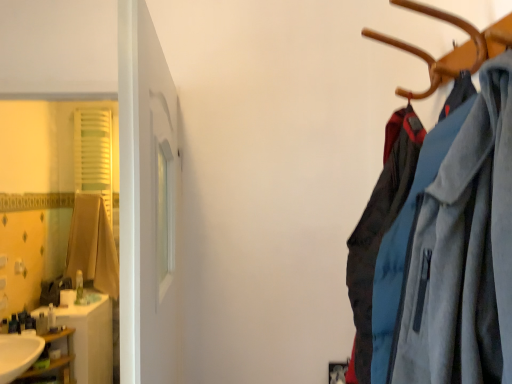
Question: Can translucent plastic soap dispenser at left, the fourth toiletry positioned from the front, be found inside translucent plastic soap at left, acting as the third toiletry starting from the front?

Choices:
 (A) no
 (B) yes

Answer: (A)

Question: Does translucent plastic soap at left, which is the 4th toiletry from right to left, have a greater width compared to translucent plastic soap dispenser at left, the 4th toiletry from the left?

Choices:
 (A) no
 (B) yes

Answer: (A)

Question: Is translucent plastic soap at left, acting as the 3th toiletry starting from the back, positioned in front of translucent plastic soap dispenser at left, the 4th toiletry from the left?

Choices:
 (A) yes
 (B) no

Answer: (A)

Question: From the image's perspective, is translucent plastic soap at left, acting as the third toiletry starting from the front, over translucent plastic soap dispenser at left, the fourth toiletry positioned from the front?

Choices:
 (A) no
 (B) yes

Answer: (A)

Question: Is translucent plastic soap at left, which is the 4th toiletry from right to left, positioned with its back to translucent plastic soap dispenser at left, the second toiletry in the right-to-left sequence?

Choices:
 (A) no
 (B) yes

Answer: (A)

Question: Are translucent plastic soap at left, which appears as the 2th toiletry when viewed from the left, and translucent plastic soap dispenser at left, acting as the 2th toiletry starting from the back, located far from each other?

Choices:
 (A) yes
 (B) no

Answer: (B)

Question: Considering the relative sizes of wooden shelf at lower left and translucent plastic soap at left, acting as the third toiletry starting from the front, in the image provided, is wooden shelf at lower left smaller than translucent plastic soap at left, acting as the third toiletry starting from the front,?

Choices:
 (A) yes
 (B) no

Answer: (B)

Question: Could you tell me if wooden shelf at lower left is facing translucent plastic soap at left, which is the 4th toiletry from right to left?

Choices:
 (A) no
 (B) yes

Answer: (A)

Question: From a real-world perspective, is wooden shelf at lower left located higher than translucent plastic soap at left, which is the 4th toiletry from right to left?

Choices:
 (A) yes
 (B) no

Answer: (B)

Question: From the image's perspective, is wooden shelf at lower left located beneath translucent plastic soap at left, acting as the 3th toiletry starting from the back?

Choices:
 (A) no
 (B) yes

Answer: (B)

Question: Is wooden shelf at lower left located outside translucent plastic soap at left, acting as the third toiletry starting from the front?

Choices:
 (A) no
 (B) yes

Answer: (B)

Question: Is wooden shelf at lower left positioned behind translucent plastic soap at left, which appears as the 2th toiletry when viewed from the left?

Choices:
 (A) yes
 (B) no

Answer: (B)

Question: Does white glossy sink at lower left have a greater width compared to translucent plastic soap at left, acting as the third toiletry starting from the front?

Choices:
 (A) no
 (B) yes

Answer: (B)